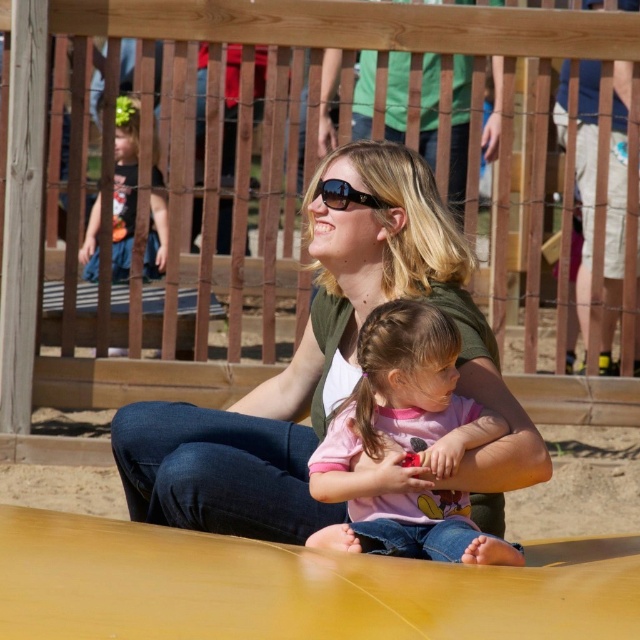
You are a photographer trying to capture a closeup of the sunglasses at center while the woman and child are sitting on the yellow slide. Since the matte green shirt at center is blocking the view, can you adjust your position to take the photo without moving the subjects? Explain your reasoning.

The matte green shirt at center is 18.58 inches away from the sunglasses at center. Since the distance between them is relatively small, you can move slightly to the side to position yourself so that the sunglasses at center is visible while the matte green shirt at center is no longer blocking the view.